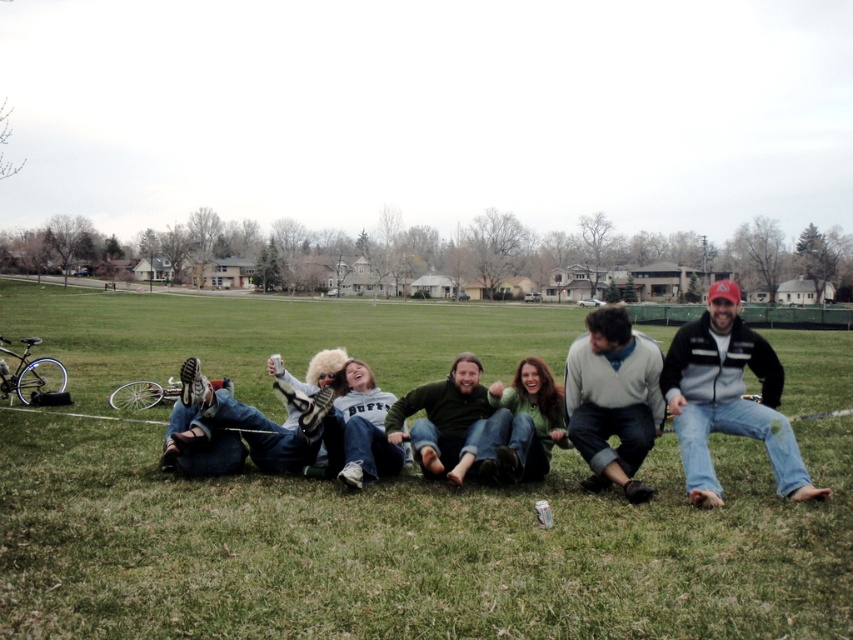
Which is behind, point (762, 371) or point (349, 392)?

Point (349, 392)

Can you confirm if dark gray fleece jacket at center is taller than white cotton sweatshirt at center?

In fact, dark gray fleece jacket at center may be shorter than white cotton sweatshirt at center.

The height and width of the screenshot is (640, 853). What are the coordinates of `dark gray fleece jacket at center` in the screenshot? It's located at (727, 397).

Locate an element on the screen. dark gray fleece jacket at center is located at coordinates (727, 397).

Describe the element at coordinates (613, 400) in the screenshot. I see `light gray sweater at center` at that location.

Does light gray sweater at center appear over white cotton sweatshirt at center?

Yes, light gray sweater at center is above white cotton sweatshirt at center.

Which is behind, point (579, 410) or point (337, 476)?

Point (579, 410)

Find the location of `light gray sweater at center`. light gray sweater at center is located at coordinates (613, 400).

Does light gray sweater at center have a greater height compared to green fuzzy sweater at center?

Yes.

Measure the distance between light gray sweater at center and camera.

6.23 meters

Locate an element on the screen. This screenshot has width=853, height=640. light gray sweater at center is located at coordinates (613, 400).